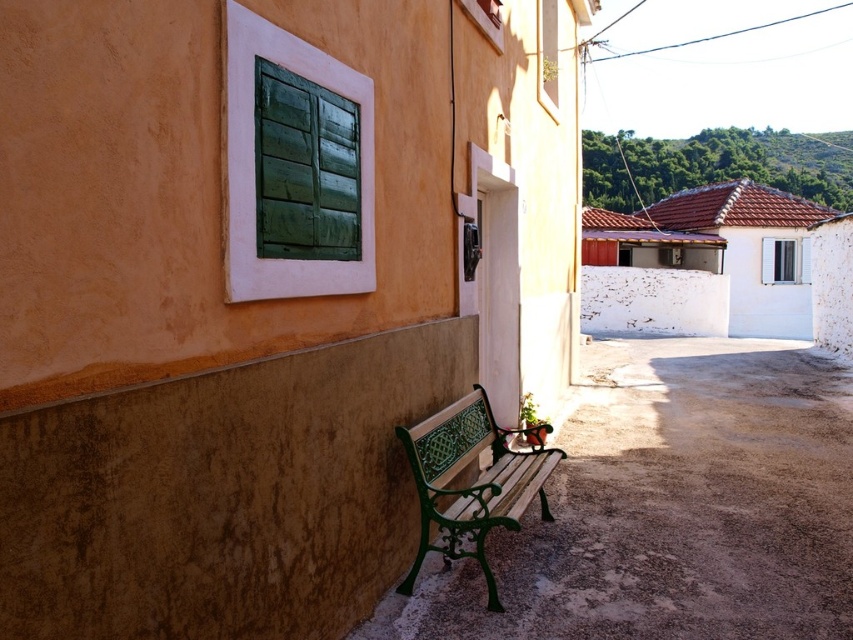
Between green painted wood bench at lower center and green wrought iron bench at lower center, which one appears on the right side from the viewer's perspective?

Positioned to the right is green painted wood bench at lower center.

Describe the element at coordinates (672, 508) in the screenshot. I see `green painted wood bench at lower center` at that location.

What do you see at coordinates (672, 508) in the screenshot?
I see `green painted wood bench at lower center` at bounding box center [672, 508].

The height and width of the screenshot is (640, 853). What are the coordinates of `green painted wood bench at lower center` in the screenshot? It's located at [672, 508].